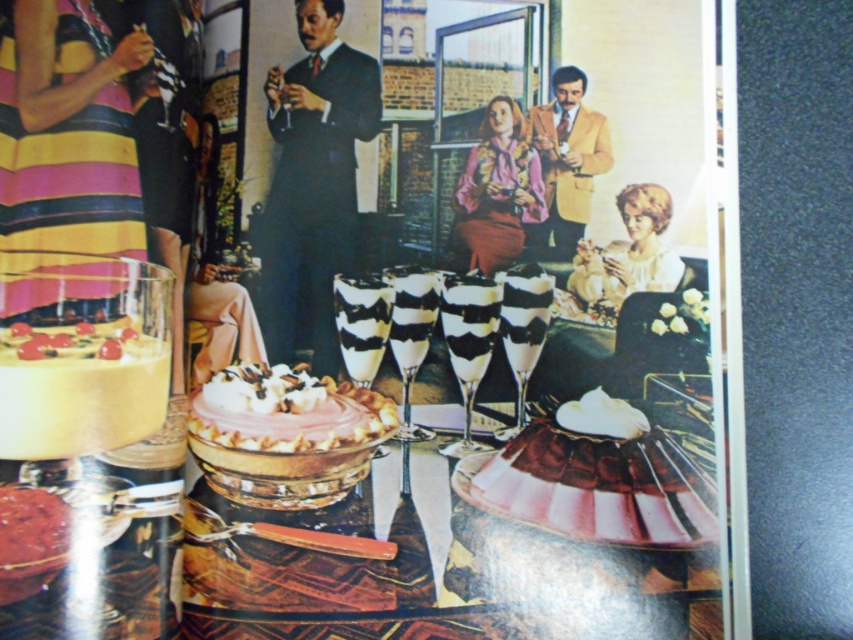
You are at the event and want to find the velvet pink skirt at lower center. According to the coordinates provided, where should you look?

The velvet pink skirt at lower center is located at point (598,486).

You are attending a formal event and notice two attendees wearing the velvet pink skirt at lower center and the yellow textured blazer at upper right. Based on their positions in the image, which clothing item is worn by someone closer to the front of the gathering?

The velvet pink skirt at lower center is located below the yellow textured blazer at upper right, so the person wearing the velvet pink skirt at lower center is closer to the front of the gathering.

You are a photographer at a formal event and need to capture a photo of the smooth black suit at center and the smooth chocolate cake at lower left. Based on their positions, which object is closer to the right edge of the frame?

The smooth black suit at center is positioned on the right side of the smooth chocolate cake at lower left, so it is closer to the right edge of the frame.